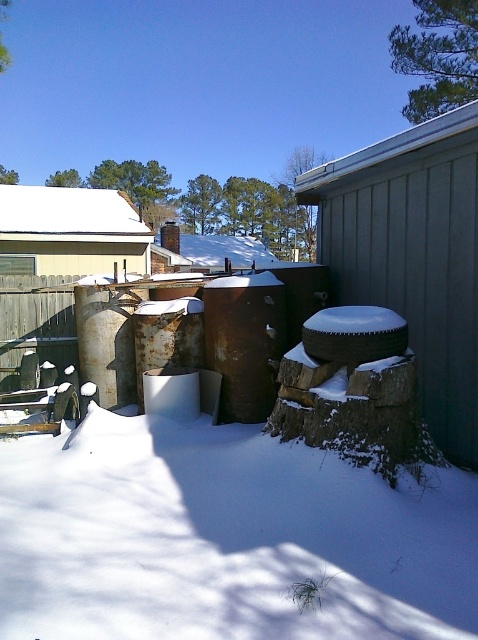
Question: Is white powdery snow at lower center smaller than snow-covered tire at right?

Choices:
 (A) yes
 (B) no

Answer: (A)

Question: Which is nearer to the white matte house at upper left?

Choices:
 (A) snow-covered tire at right
 (B) white powdery snow at lower center

Answer: (A)

Question: Which object is positioned closest to the white powdery snow at lower center?

Choices:
 (A) rusty metal chimney at upper center
 (B) white matte house at upper left

Answer: (B)

Question: Among these objects, which one is nearest to the camera?

Choices:
 (A) white powdery snow at lower center
 (B) snow-covered tire at right

Answer: (A)

Question: In this image, where is white powdery snow at lower center located relative to rusty metal chimney at upper center?

Choices:
 (A) left
 (B) right

Answer: (B)

Question: Is white matte house at upper left to the right of rusty metal chimney at upper center from the viewer's perspective?

Choices:
 (A) no
 (B) yes

Answer: (A)